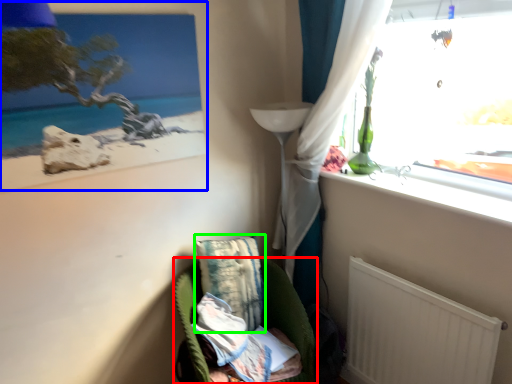
Question: Based on their relative distances, which object is farther from furniture (highlighted by a red box)? Choose from picture frame (highlighted by a blue box) and pillow (highlighted by a green box).

Choices:
 (A) picture frame
 (B) pillow

Answer: (A)